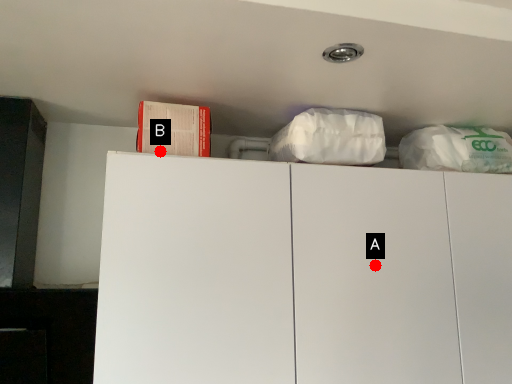
Question: Two points are circled on the image, labeled by A and B beside each circle. Which point is farther from the camera taking this photo?

Choices:
 (A) A is further
 (B) B is further

Answer: (A)